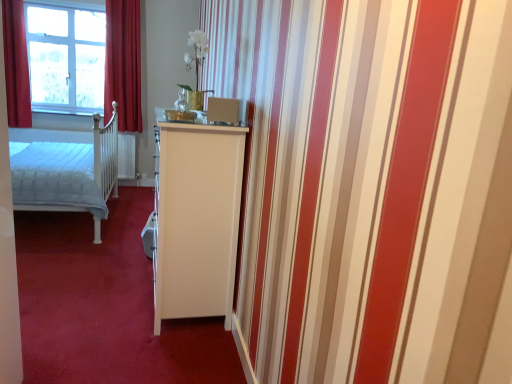
Measure the distance between point (41,11) and camera.

Point (41,11) and camera are 4.29 meters apart.

Where is `red velvet curtain at left, marked as the first curtain in a left-to-right arrangement`? This screenshot has height=384, width=512. red velvet curtain at left, marked as the first curtain in a left-to-right arrangement is located at coordinates (16, 64).

Identify the location of white quilted fabric bed at left. Image resolution: width=512 pixels, height=384 pixels. (73, 176).

In terms of size, does red velvet curtain at left, marked as the first curtain in a left-to-right arrangement, appear bigger or smaller than clear glass window at upper left?

In the image, red velvet curtain at left, marked as the first curtain in a left-to-right arrangement, appears to be smaller than clear glass window at upper left.

From a real-world perspective, is red velvet curtain at left, which appears as the second curtain when viewed from the right, above or below clear glass window at upper left?

red velvet curtain at left, which appears as the second curtain when viewed from the right, is situated lower than clear glass window at upper left in the real world.

From the image's perspective, which one is positioned lower, red velvet curtain at left, which appears as the second curtain when viewed from the right, or clear glass window at upper left?

red velvet curtain at left, which appears as the second curtain when viewed from the right, appears lower in the image.

Is point (115, 119) behind point (25, 38)?

Yes.

From a real-world perspective, between white quilted fabric bed at left and red velvet curtain at left, which appears as the second curtain when viewed from the right, who is vertically higher?

Answer: red velvet curtain at left, which appears as the second curtain when viewed from the right, from a real-world perspective.

Would you say white quilted fabric bed at left is outside red velvet curtain at left, which appears as the second curtain when viewed from the right?

Yes.

Is velvet red curtain at upper left, which ranks as the first curtain in right-to-left order, looking in the opposite direction of white quilted fabric bed at left?

No, velvet red curtain at upper left, which ranks as the first curtain in right-to-left order, is not facing away from white quilted fabric bed at left.

Who is shorter, velvet red curtain at upper left, the second curtain positioned from the left, or white quilted fabric bed at left?

white quilted fabric bed at left.

From the image's perspective, between velvet red curtain at upper left, the second curtain positioned from the left, and white quilted fabric bed at left, who is located below?

white quilted fabric bed at left is shown below in the image.

Can you confirm if velvet red curtain at upper left, the second curtain positioned from the left, is positioned to the left of white quilted fabric bed at left?

In fact, velvet red curtain at upper left, the second curtain positioned from the left, is to the right of white quilted fabric bed at left.

From a real-world perspective, which object stands above the other?

In real-world perspective, clear glass window at upper left is above.

Considering the positions of objects clear glass window at upper left and white quilted fabric bed at left in the image provided, who is behind, clear glass window at upper left or white quilted fabric bed at left?

clear glass window at upper left is behind.

Is clear glass window at upper left at the right side of white quilted fabric bed at left?

Incorrect, clear glass window at upper left is not on the right side of white quilted fabric bed at left.

From the image's perspective, which is below, clear glass window at upper left or white quilted fabric bed at left?

From the image's view, white quilted fabric bed at left is below.

Considering the positions of point (112, 364) and point (27, 113), is point (112, 364) closer or farther from the camera than point (27, 113)?

Point (112, 364).

From the image's perspective, is white glossy cabinet at center above red velvet curtain at left, which appears as the second curtain when viewed from the right?

Actually, white glossy cabinet at center appears below red velvet curtain at left, which appears as the second curtain when viewed from the right, in the image.

From the image's perspective, starting from the white glossy cabinet at center, which curtain is the 1st one above? Please provide its 2D coordinates.

[(16, 64)]

Is white glossy cabinet at center in contact with red velvet curtain at left, marked as the first curtain in a left-to-right arrangement?

There is a gap between white glossy cabinet at center and red velvet curtain at left, marked as the first curtain in a left-to-right arrangement.

Can you see white glossy cabinet at center touching velvet red curtain at upper left, which ranks as the first curtain in right-to-left order?

No, white glossy cabinet at center is not in contact with velvet red curtain at upper left, which ranks as the first curtain in right-to-left order.

From a real-world perspective, is white glossy cabinet at center beneath velvet red curtain at upper left, which ranks as the first curtain in right-to-left order?

Yes, from a real-world perspective, white glossy cabinet at center is below velvet red curtain at upper left, which ranks as the first curtain in right-to-left order.

Based on their sizes in the image, would you say white glossy cabinet at center is bigger or smaller than velvet red curtain at upper left, which ranks as the first curtain in right-to-left order?

In the image, white glossy cabinet at center appears to be larger than velvet red curtain at upper left, which ranks as the first curtain in right-to-left order.

Do you think white glossy cabinet at center is within velvet red curtain at upper left, the second curtain positioned from the left, or outside of it?

white glossy cabinet at center is not enclosed by velvet red curtain at upper left, the second curtain positioned from the left.

Considering the sizes of objects red velvet curtain at left, marked as the first curtain in a left-to-right arrangement, and white glossy cabinet at center in the image provided, who is shorter, red velvet curtain at left, marked as the first curtain in a left-to-right arrangement, or white glossy cabinet at center?

white glossy cabinet at center.

Is red velvet curtain at left, which appears as the second curtain when viewed from the right, not near white glossy cabinet at center?

Yes.

Consider the image. Considering the positions of objects red velvet curtain at left, which appears as the second curtain when viewed from the right, and white glossy cabinet at center in the image provided, who is more to the right, red velvet curtain at left, which appears as the second curtain when viewed from the right, or white glossy cabinet at center?

Positioned to the right is white glossy cabinet at center.

Considering the sizes of objects red velvet curtain at left, which appears as the second curtain when viewed from the right, and white glossy cabinet at center in the image provided, who is wider, red velvet curtain at left, which appears as the second curtain when viewed from the right, or white glossy cabinet at center?

With larger width is white glossy cabinet at center.

From the clear glass window at upper left, count 2nd curtains forward and point to it. Please provide its 2D coordinates.

[(16, 64)]

Where is `curtain that is the 1st one when counting backward from the white quilted fabric bed at left`? The image size is (512, 384). curtain that is the 1st one when counting backward from the white quilted fabric bed at left is located at coordinates (16, 64).

Estimate the real-world distances between objects in this image. Which object is further from clear glass window at upper left, white glossy cabinet at center or red velvet curtain at left, which appears as the second curtain when viewed from the right?

Among the two, white glossy cabinet at center is located further to clear glass window at upper left.

Looking at the image, which one is located closer to clear glass window at upper left, velvet red curtain at upper left, the second curtain positioned from the left, or white glossy cabinet at center?

velvet red curtain at upper left, the second curtain positioned from the left, is closer to clear glass window at upper left.

From the image, which object appears to be farther from velvet red curtain at upper left, the second curtain positioned from the left, red velvet curtain at left, which appears as the second curtain when viewed from the right, or white quilted fabric bed at left?

Among the two, white quilted fabric bed at left is located further to velvet red curtain at upper left, the second curtain positioned from the left.

Based on their spatial positions, is velvet red curtain at upper left, the second curtain positioned from the left, or clear glass window at upper left closer to white glossy cabinet at center?

clear glass window at upper left lies closer to white glossy cabinet at center than the other object.

When comparing their distances from clear glass window at upper left, does red velvet curtain at left, which appears as the second curtain when viewed from the right, or white quilted fabric bed at left seem further?

Based on the image, white quilted fabric bed at left appears to be further to clear glass window at upper left.

When comparing their distances from velvet red curtain at upper left, the second curtain positioned from the left, does white glossy cabinet at center or red velvet curtain at left, marked as the first curtain in a left-to-right arrangement, seem closer?

Based on the image, red velvet curtain at left, marked as the first curtain in a left-to-right arrangement, appears to be nearer to velvet red curtain at upper left, the second curtain positioned from the left.

Considering their positions, is velvet red curtain at upper left, which ranks as the first curtain in right-to-left order, positioned further to red velvet curtain at left, which appears as the second curtain when viewed from the right, than clear glass window at upper left?

velvet red curtain at upper left, which ranks as the first curtain in right-to-left order, lies further to red velvet curtain at left, which appears as the second curtain when viewed from the right, than the other object.

Based on their spatial positions, is clear glass window at upper left or red velvet curtain at left, which appears as the second curtain when viewed from the right, further from white quilted fabric bed at left?

The object further to white quilted fabric bed at left is clear glass window at upper left.

Identify the location of bed located between white glossy cabinet at center and velvet red curtain at upper left, which ranks as the first curtain in right-to-left order, in the depth direction. This screenshot has height=384, width=512. (73, 176).

Image resolution: width=512 pixels, height=384 pixels. Identify the location of window situated between red velvet curtain at left, marked as the first curtain in a left-to-right arrangement, and velvet red curtain at upper left, which ranks as the first curtain in right-to-left order, from left to right. (66, 58).

Find the location of a particular element. Image resolution: width=512 pixels, height=384 pixels. bed located between white glossy cabinet at center and clear glass window at upper left in the depth direction is located at coordinates (73, 176).

Where is `bed positioned between white glossy cabinet at center and red velvet curtain at left, marked as the first curtain in a left-to-right arrangement, from near to far`? This screenshot has height=384, width=512. bed positioned between white glossy cabinet at center and red velvet curtain at left, marked as the first curtain in a left-to-right arrangement, from near to far is located at coordinates (73, 176).